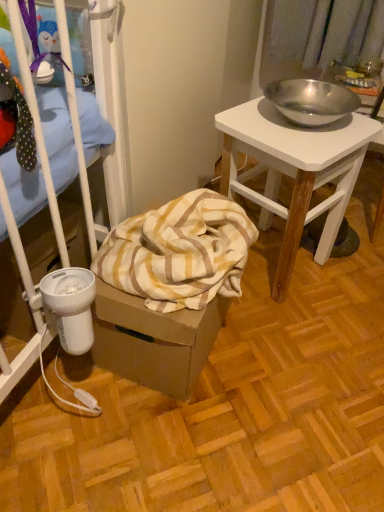
Question: From a real-world perspective, is polished metal bowl at upper right located beneath yellow striped fabric at lower left?

Choices:
 (A) no
 (B) yes

Answer: (B)

Question: Would you consider polished metal bowl at upper right to be distant from yellow striped fabric at lower left?

Choices:
 (A) no
 (B) yes

Answer: (A)

Question: Is polished metal bowl at upper right closer to camera compared to yellow striped fabric at lower left?

Choices:
 (A) yes
 (B) no

Answer: (B)

Question: Can you confirm if polished metal bowl at upper right is thinner than yellow striped fabric at lower left?

Choices:
 (A) no
 (B) yes

Answer: (B)

Question: Is polished metal bowl at upper right positioned beyond the bounds of yellow striped fabric at lower left?

Choices:
 (A) no
 (B) yes

Answer: (B)

Question: Does polished metal bowl at upper right turn towards yellow striped fabric at lower left?

Choices:
 (A) no
 (B) yes

Answer: (A)

Question: From the image's perspective, does yellow striped fabric at lower left appear lower than polished metal bowl at upper right?

Choices:
 (A) no
 (B) yes

Answer: (B)

Question: From a real-world perspective, is yellow striped fabric at lower left under polished metal bowl at upper right?

Choices:
 (A) yes
 (B) no

Answer: (B)

Question: Are yellow striped fabric at lower left and polished metal bowl at upper right far apart?

Choices:
 (A) no
 (B) yes

Answer: (A)

Question: Is yellow striped fabric at lower left positioned with its back to polished metal bowl at upper right?

Choices:
 (A) no
 (B) yes

Answer: (A)

Question: Is yellow striped fabric at lower left further to the viewer compared to polished metal bowl at upper right?

Choices:
 (A) yes
 (B) no

Answer: (B)

Question: From a real-world perspective, is yellow striped fabric at lower left physically above polished metal bowl at upper right?

Choices:
 (A) yes
 (B) no

Answer: (A)

Question: In terms of width, does yellow striped fabric at lower left look wider or thinner when compared to polished metal bowl at upper right?

Choices:
 (A) thin
 (B) wide

Answer: (B)